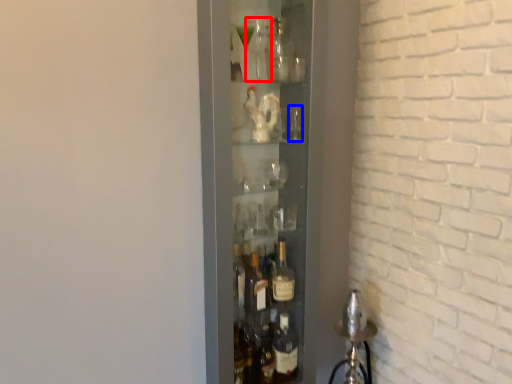
Question: Which object is further to the camera taking this photo, bottle (highlighted by a red box) or shot glass (highlighted by a blue box)?

Choices:
 (A) bottle
 (B) shot glass

Answer: (B)